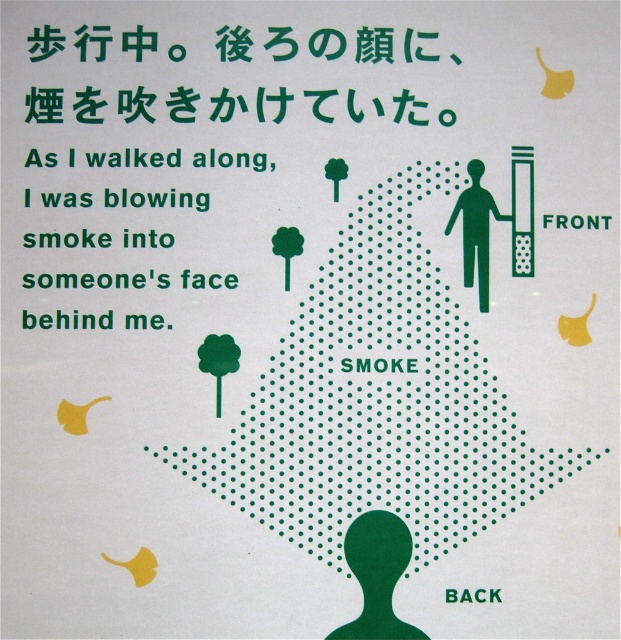
Question: Can you confirm if green dotted text at upper center is positioned to the left of green silhouette figure at right?

Choices:
 (A) yes
 (B) no

Answer: (A)

Question: Does green dotted text at upper center have a larger size compared to green silhouette figure at right?

Choices:
 (A) no
 (B) yes

Answer: (B)

Question: Is green dotted text at upper center wider than green silhouette figure at right?

Choices:
 (A) no
 (B) yes

Answer: (B)

Question: Which object is farther from the camera taking this photo?

Choices:
 (A) green dotted text at upper center
 (B) green silhouette figure at right

Answer: (B)